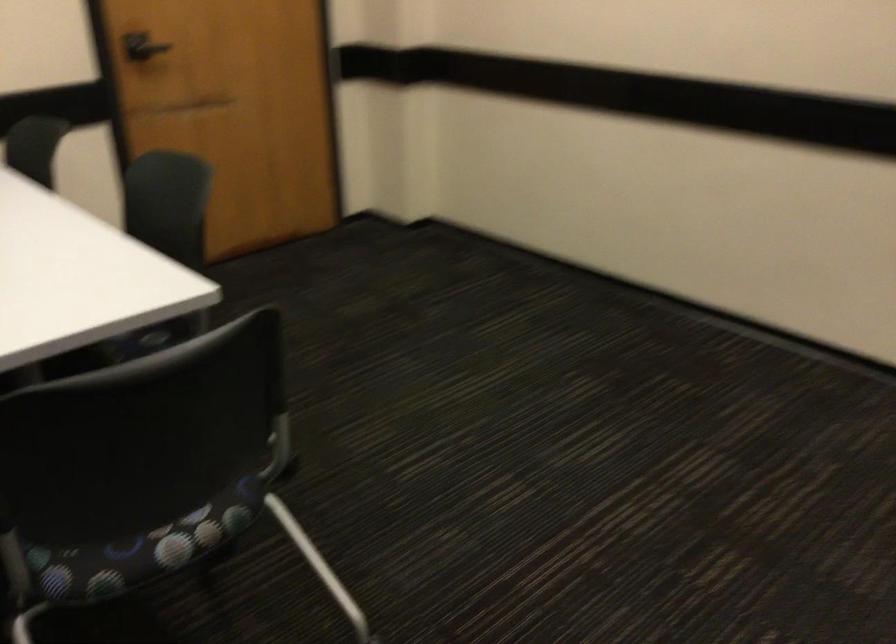
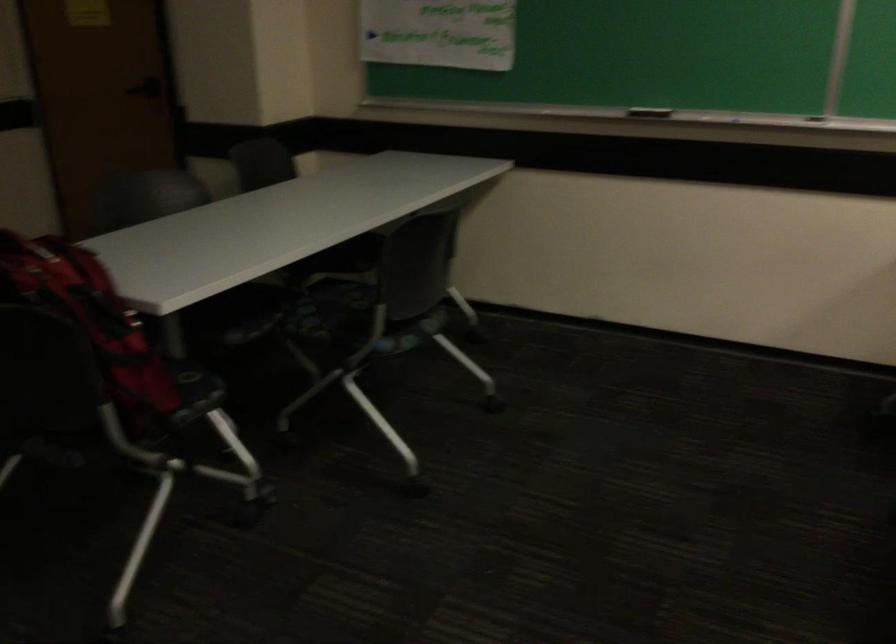
Question: The camera is either moving clockwise (left) or counter-clockwise (right) around the object. The first image is from the beginning of the video and the second image is from the end. Is the camera moving left or right when shooting the video?

Choices:
 (A) Left
 (B) Right

Answer: (B)